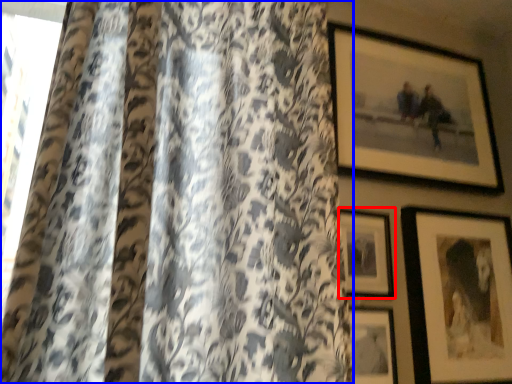
Question: Which point is further to the camera, picture frame (highlighted by a red box) or curtain (highlighted by a blue box)?

Choices:
 (A) picture frame
 (B) curtain

Answer: (A)